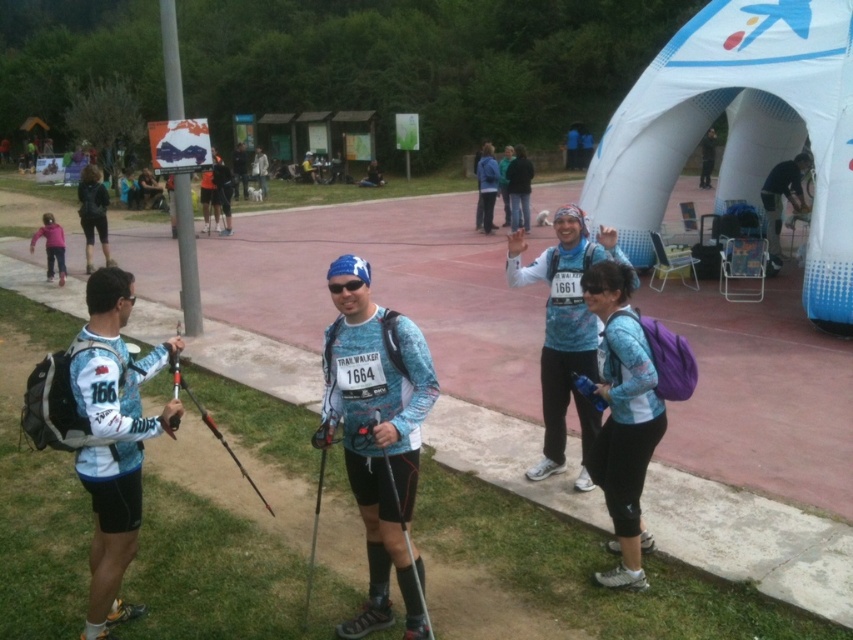
Question: Which point is closer to the camera?

Choices:
 (A) matte blue jersey at left
 (B) black rubber ski pole at center

Answer: (B)

Question: In this image, where is blue textured shirt at center located relative to dark blue fabric shirt at right?

Choices:
 (A) right
 (B) left

Answer: (B)

Question: Does matte blue jersey at left appear on the left side of black rubber ski pole at center?

Choices:
 (A) no
 (B) yes

Answer: (B)

Question: Can you confirm if black plastic ski pole at center is thinner than matte black ski pole at left?

Choices:
 (A) yes
 (B) no

Answer: (B)

Question: Which point is farther to the camera?

Choices:
 (A) blue fabric jacket at upper center
 (B) black rubber ski pole at center
 (C) matte black ski pole at center
 (D) blue fabric skier at center

Answer: (A)

Question: Which point is closer to the camera taking this photo?

Choices:
 (A) (375, 413)
 (B) (625, 326)
 (C) (405, 472)

Answer: (A)